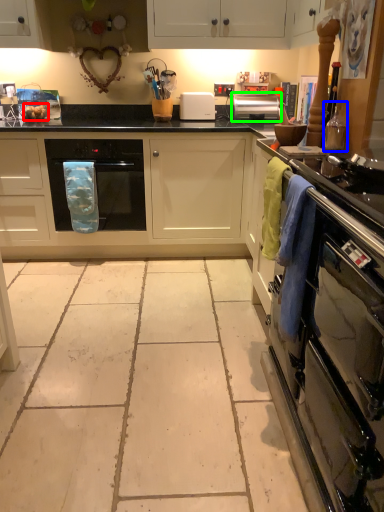
Question: Considering the real-world distances, which object is farthest from food (highlighted by a red box)? appliance (highlighted by a blue box) or kitchen appliance (highlighted by a green box)?

Choices:
 (A) appliance
 (B) kitchen appliance

Answer: (A)